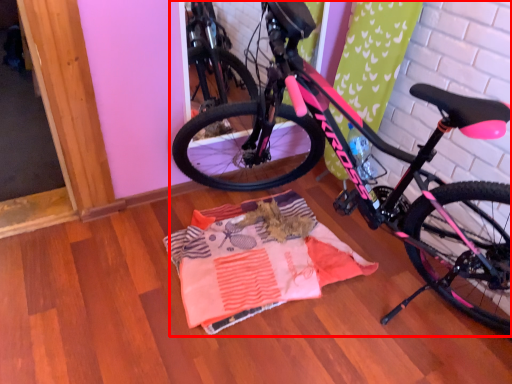
Question: In this image, where is bicycle (annotated by the red box) located relative to blanket?

Choices:
 (A) right
 (B) left

Answer: (A)